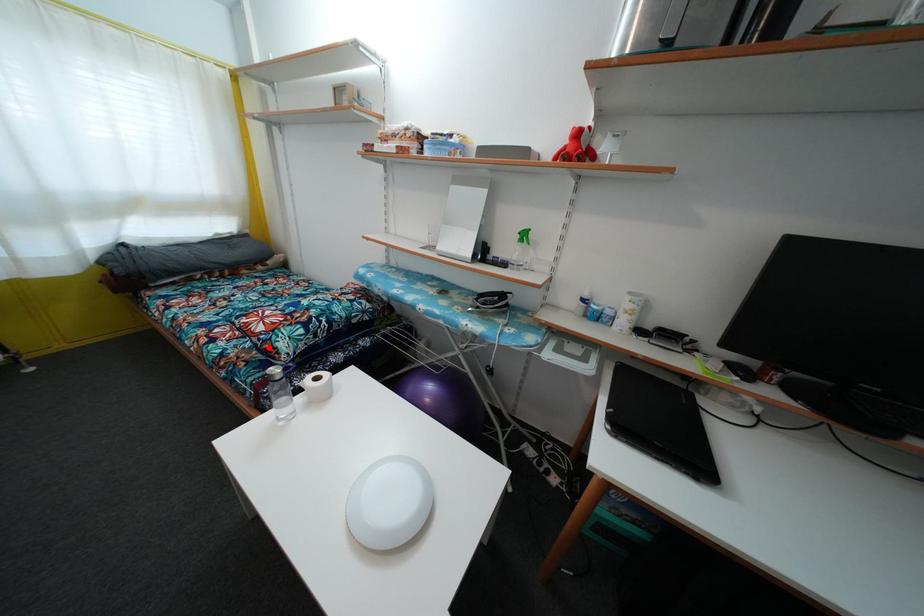
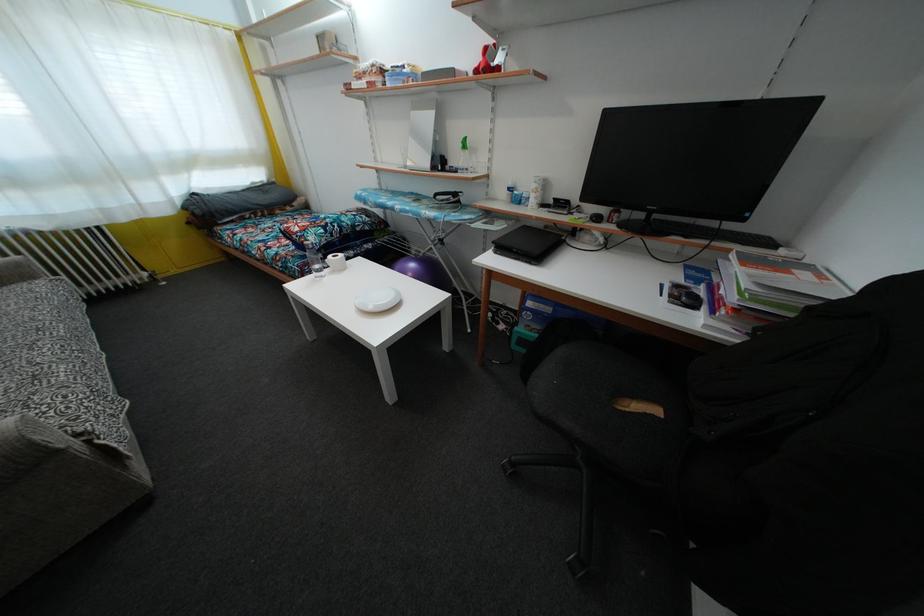
Locate, in the second image, the point that corresponds to the highlighted location in the first image.

(305, 244)